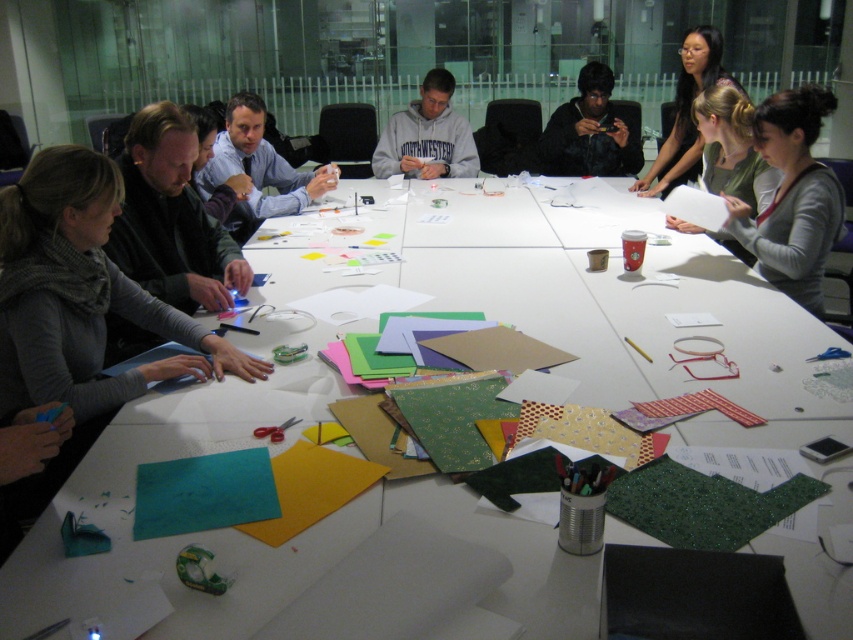
Question: Based on their relative distances, which object is farther from the dark brown textured sweater at upper center?

Choices:
 (A) matte gray sweater at upper right
 (B) matte black hair at upper right
 (C) matte black laptop at left

Answer: (C)

Question: Which point is closer to the camera taking this photo?

Choices:
 (A) (431, 301)
 (B) (425, 115)

Answer: (A)

Question: Does white paper at center have a smaller size compared to dark brown textured sweater at upper center?

Choices:
 (A) no
 (B) yes

Answer: (A)

Question: Which object is the farthest from the matte blue shirt at upper center?

Choices:
 (A) dark brown textured sweater at upper center
 (B) gray fleece hoodie at center

Answer: (A)

Question: Is matte black laptop at left bigger than matte blue shirt at upper center?

Choices:
 (A) no
 (B) yes

Answer: (A)

Question: Does white paper at center appear under matte black hair at upper right?

Choices:
 (A) yes
 (B) no

Answer: (A)